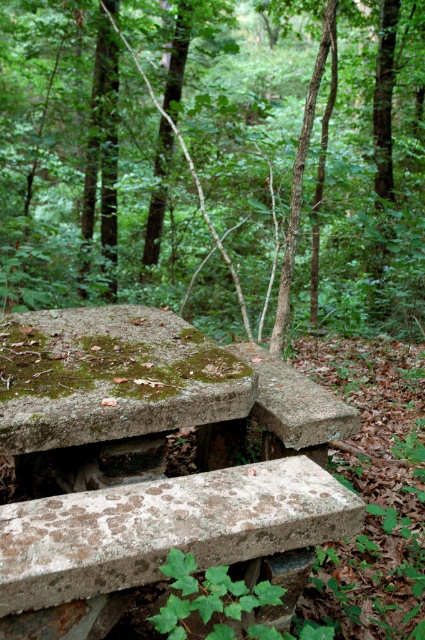
Does green mossy stone at lower left come behind rusty concrete picnic table at upper center?

Yes, it is.

What are the coordinates of `green mossy stone at lower left` in the screenshot? It's located at (214, 161).